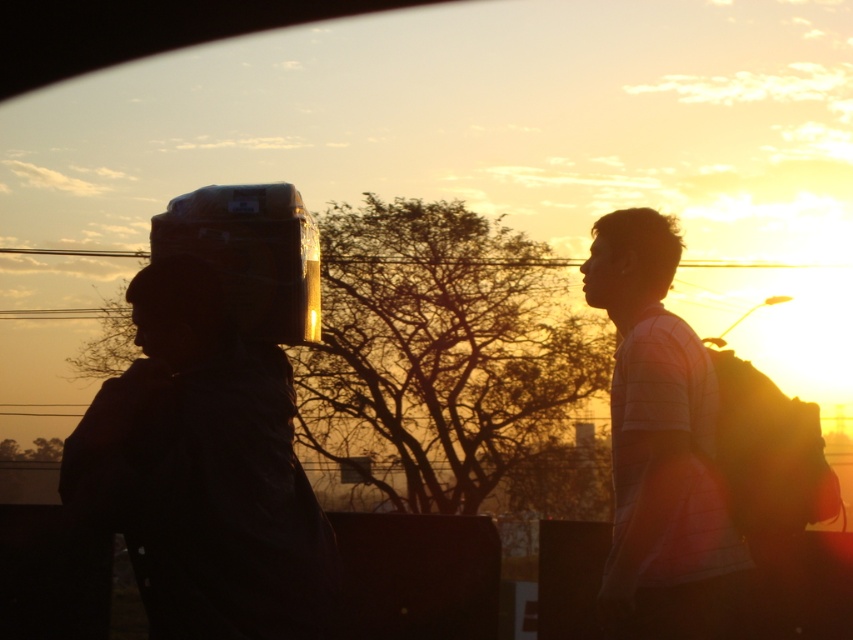
You are a photographer trying to capture the sunset scene. You notice the matte black helmet at left and the white striped shirt at right. Which object would appear wider in your photo?

The matte black helmet at left appears wider in the photo because its width is larger than that of the white striped shirt at right.

You are an artist trying to sketch the scene. You want to place the matte black helmet at left accurately. According to the coordinates provided, where should you position it on your canvas?

The matte black helmet at left should be positioned at the coordinates 0.738 on the x axis and 0.240 on the y axis on the canvas.

You are a photographer trying to capture the sunset scene. You notice the matte black helmet at left and the white striped shirt at right. Which object should you focus on first if you want to ensure both are in sharp focus without moving the camera?

The matte black helmet at left is in front of the white striped shirt at right. To keep both in focus, you should focus on the matte black helmet at left first since it is closer to the camera.